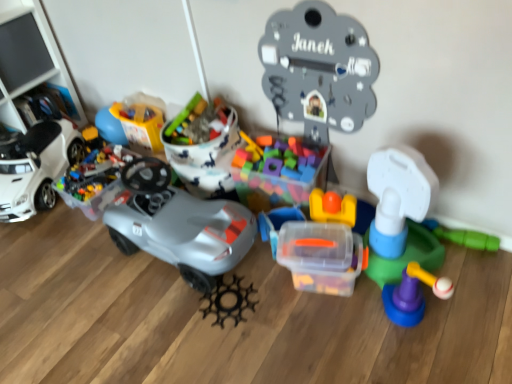
What is the approximate width of translucent plastic toy car at left, which is the first toy from left to right?

17.70 inches.

Image resolution: width=512 pixels, height=384 pixels. Describe the element at coordinates (95, 181) in the screenshot. I see `translucent plastic toy car at left, which is the first toy from left to right` at that location.

Image resolution: width=512 pixels, height=384 pixels. Describe the element at coordinates (403, 233) in the screenshot. I see `white plastic tower at right, the 8th toy when ordered from left to right` at that location.

Image resolution: width=512 pixels, height=384 pixels. I want to click on white plastic tower at right, the 8th toy when ordered from left to right, so click(403, 233).

What do you see at coordinates (277, 224) in the screenshot?
I see `translucent plastic container at center, acting as the 5th toy starting from the left` at bounding box center [277, 224].

The height and width of the screenshot is (384, 512). What do you see at coordinates (178, 224) in the screenshot?
I see `matte gray car at center, acting as the sixth toy starting from the right` at bounding box center [178, 224].

Identify the location of translucent plastic toy car at left, placed as the eighth toy when sorted from right to left. (95, 181).

From the image's perspective, is metallic gray clock at upper center, the sixth toy from the left, below white plastic tower at right, which ranks as the first toy in right-to-left order?

No, from the image's perspective, metallic gray clock at upper center, the sixth toy from the left, is not beneath white plastic tower at right, which ranks as the first toy in right-to-left order.

Is metallic gray clock at upper center, the sixth toy from the left, taller or shorter than white plastic tower at right, which ranks as the first toy in right-to-left order?

metallic gray clock at upper center, the sixth toy from the left, is taller than white plastic tower at right, which ranks as the first toy in right-to-left order.

Based on the photo, does metallic gray clock at upper center, placed as the 3th toy when sorted from right to left, touch white plastic tower at right, which ranks as the first toy in right-to-left order?

metallic gray clock at upper center, placed as the 3th toy when sorted from right to left, and white plastic tower at right, which ranks as the first toy in right-to-left order, are not in contact.

Measure the distance from metallic gray clock at upper center, placed as the 3th toy when sorted from right to left, to white plastic tower at right, the 8th toy when ordered from left to right.

They are 17.82 inches apart.

Considering their positions, is white matte toy car at left located in front of or behind black plastic gear at center, which is the fifth toy from right to left?

white matte toy car at left is behind black plastic gear at center, which is the fifth toy from right to left.

Can you confirm if white matte toy car at left is positioned to the right of black plastic gear at center, placed as the 4th toy when sorted from left to right?

No.

Starting from the white matte toy car at left, which toy is the 2nd one in front? Please provide its 2D coordinates.

[(229, 300)]

In the scene shown: Between white matte toy car at left and black plastic gear at center, placed as the 4th toy when sorted from left to right, which one has larger size?

white matte toy car at left is bigger.

Is black plastic gear at center, which is the fifth toy from right to left, smaller than white matte toy car at left?

Yes.

Is black plastic gear at center, placed as the 4th toy when sorted from left to right, positioned in front of white matte toy car at left?

Yes.

Considering the sizes of black plastic gear at center, which is the fifth toy from right to left, and white matte toy car at left in the image, is black plastic gear at center, which is the fifth toy from right to left, wider or thinner than white matte toy car at left?

Clearly, black plastic gear at center, which is the fifth toy from right to left, has less width compared to white matte toy car at left.

Can you tell me how much black plastic gear at center, placed as the 4th toy when sorted from left to right, and white matte toy car at left differ in facing direction?

The angular difference between black plastic gear at center, placed as the 4th toy when sorted from left to right, and white matte toy car at left is 21.9 degrees.

Does translucent plastic container at center, acting as the 5th toy starting from the left, have a greater width compared to black plastic gear at center, placed as the 4th toy when sorted from left to right?

Incorrect, the width of translucent plastic container at center, acting as the 5th toy starting from the left, does not surpass that of black plastic gear at center, placed as the 4th toy when sorted from left to right.

Is translucent plastic container at center, acting as the 5th toy starting from the left, looking in the opposite direction of black plastic gear at center, which is the fifth toy from right to left?

That's not correct — translucent plastic container at center, acting as the 5th toy starting from the left, is not looking away from black plastic gear at center, which is the fifth toy from right to left.

Does point (270, 224) lie in front of point (248, 308)?

No, (270, 224) is behind (248, 308).

From the image's perspective, is white plastic tower at right, which ranks as the first toy in right-to-left order, located beneath transparent plastic container at center, which is counted as the 2th toy, starting from the right?

No.

How many degrees apart are the facing directions of white plastic tower at right, the 8th toy when ordered from left to right, and transparent plastic container at center, which is counted as the 2th toy, starting from the right?

The facing directions of white plastic tower at right, the 8th toy when ordered from left to right, and transparent plastic container at center, which is counted as the 2th toy, starting from the right, are 27.9 degrees apart.

Considering the relative sizes of white plastic tower at right, the 8th toy when ordered from left to right, and transparent plastic container at center, the seventh toy when ordered from left to right, in the image provided, is white plastic tower at right, the 8th toy when ordered from left to right, taller than transparent plastic container at center, the seventh toy when ordered from left to right,?

Yes, white plastic tower at right, the 8th toy when ordered from left to right, is taller than transparent plastic container at center, the seventh toy when ordered from left to right.

Is point (381, 154) positioned before point (270, 235)?

Yes.

Is translucent plastic container at center, which is counted as the 4th toy, starting from the right, at the right side of metallic gray clock at upper center, the sixth toy from the left?

In fact, translucent plastic container at center, which is counted as the 4th toy, starting from the right, is to the left of metallic gray clock at upper center, the sixth toy from the left.

Who is more distant, translucent plastic container at center, acting as the 5th toy starting from the left, or metallic gray clock at upper center, the sixth toy from the left?

translucent plastic container at center, acting as the 5th toy starting from the left, is further from the camera.

From the image's perspective, count 4th toys downward from the metallic gray clock at upper center, the sixth toy from the left, and point to it. Please provide its 2D coordinates.

[(277, 224)]

From the image's perspective, which one is positioned lower, translucent plastic container at center, acting as the 5th toy starting from the left, or metallic gray clock at upper center, the sixth toy from the left?

translucent plastic container at center, acting as the 5th toy starting from the left, from the image's perspective.

Can you tell me how much transparent plastic container at center, the seventh toy when ordered from left to right, and translucent plastic container at upper left, the 2th toy from the left, differ in facing direction?

There is a 16.9-degree angle between the facing directions of transparent plastic container at center, the seventh toy when ordered from left to right, and translucent plastic container at upper left, the 2th toy from the left.

Is transparent plastic container at center, the seventh toy when ordered from left to right, further to the viewer compared to translucent plastic container at upper left, the 2th toy from the left?

No, the depth of transparent plastic container at center, the seventh toy when ordered from left to right, is less than that of translucent plastic container at upper left, the 2th toy from the left.

Can you confirm if transparent plastic container at center, which is counted as the 2th toy, starting from the right, is taller than translucent plastic container at upper left, the 2th toy from the left?

Incorrect, the height of transparent plastic container at center, which is counted as the 2th toy, starting from the right, is not larger of that of translucent plastic container at upper left, the 2th toy from the left.

Where is `the 2nd toy positioned above the white plastic tower at right, the 8th toy when ordered from left to right (from the image's perspective)`? the 2nd toy positioned above the white plastic tower at right, the 8th toy when ordered from left to right (from the image's perspective) is located at coordinates (319, 66).

Where is `the 6th toy directly beneath the white matte toy car at left (from a real-world perspective)`? the 6th toy directly beneath the white matte toy car at left (from a real-world perspective) is located at coordinates (229, 300).

When comparing their distances from black plastic gear at center, which is the fifth toy from right to left, does translucent plastic container at center, which is counted as the 4th toy, starting from the right, or translucent plastic toy car at left, which is the first toy from left to right, seem closer?

translucent plastic container at center, which is counted as the 4th toy, starting from the right.

When comparing their distances from white plastic tower at right, which ranks as the first toy in right-to-left order, does translucent plastic container at center, acting as the 5th toy starting from the left, or translucent plastic toy car at left, placed as the eighth toy when sorted from right to left, seem further?

The object further to white plastic tower at right, which ranks as the first toy in right-to-left order, is translucent plastic toy car at left, placed as the eighth toy when sorted from right to left.

Looking at the image, which one is located further to translucent plastic container at upper left, the 2th toy from the left, metallic gray clock at upper center, the sixth toy from the left, or transparent plastic container at center, the seventh toy when ordered from left to right?

Among the two, transparent plastic container at center, the seventh toy when ordered from left to right, is located further to translucent plastic container at upper left, the 2th toy from the left.

From the image, which object appears to be farther from translucent plastic container at center, acting as the 5th toy starting from the left, matte gray car at center, arranged as the 3th toy when viewed from the left, or translucent plastic toy car at left, placed as the eighth toy when sorted from right to left?

translucent plastic toy car at left, placed as the eighth toy when sorted from right to left, is positioned further to the anchor translucent plastic container at center, acting as the 5th toy starting from the left.

When comparing their distances from white matte toy car at left, does black plastic gear at center, placed as the 4th toy when sorted from left to right, or translucent plastic container at upper left, the seventh toy positioned from the right, seem closer?

Based on the image, translucent plastic container at upper left, the seventh toy positioned from the right, appears to be nearer to white matte toy car at left.

From the picture: Looking at the image, which one is located further to matte gray car at center, arranged as the 3th toy when viewed from the left, translucent plastic container at center, which is counted as the 4th toy, starting from the right, or white plastic tower at right, the 8th toy when ordered from left to right?

white plastic tower at right, the 8th toy when ordered from left to right, is further to matte gray car at center, arranged as the 3th toy when viewed from the left.

Looking at the image, which one is located closer to translucent plastic container at center, which is counted as the 4th toy, starting from the right, white plastic tower at right, the 8th toy when ordered from left to right, or translucent plastic container at upper left, the seventh toy positioned from the right?

Based on the image, white plastic tower at right, the 8th toy when ordered from left to right, appears to be nearer to translucent plastic container at center, which is counted as the 4th toy, starting from the right.

Considering their positions, is transparent plastic container at center, which is counted as the 2th toy, starting from the right, positioned further to white matte toy car at left than translucent plastic toy car at left, which is the first toy from left to right?

transparent plastic container at center, which is counted as the 2th toy, starting from the right, is positioned further to the anchor white matte toy car at left.

You are a GUI agent. You are given a task and a screenshot of the screen. Output one action in this format:
    pyautogui.click(x=<x>, y=<y>)
    Task: Click on the car between matte gray car at center, arranged as the 3th toy when viewed from the left, and translucent plastic container at upper left, the seventh toy positioned from the right, along the z-axis
    
    Given the screenshot: What is the action you would take?
    (x=36, y=167)

Find the location of a particular element. The width and height of the screenshot is (512, 384). toy between white matte toy car at left and translucent plastic container at upper left, the 2th toy from the left, from left to right is located at coordinates (95, 181).

Where is `toy between matte gray car at center, acting as the sixth toy starting from the right, and translucent plastic container at center, acting as the 5th toy starting from the left, in the horizontal direction`? The height and width of the screenshot is (384, 512). toy between matte gray car at center, acting as the sixth toy starting from the right, and translucent plastic container at center, acting as the 5th toy starting from the left, in the horizontal direction is located at coordinates (229, 300).